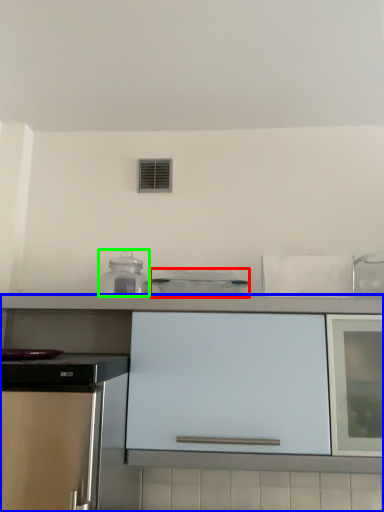
Question: Which object is positioned closest to kitchen appliance (highlighted by a red box)? Select from cabinetry (highlighted by a blue box) and kitchen appliance (highlighted by a green box).

Choices:
 (A) cabinetry
 (B) kitchen appliance

Answer: (B)